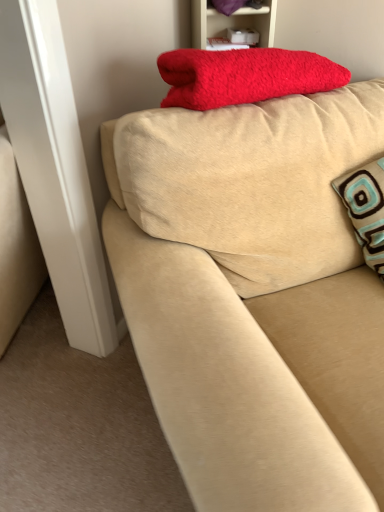
Image resolution: width=384 pixels, height=512 pixels. What are the coordinates of `red fluffy blanket at upper center` in the screenshot? It's located at (232, 22).

In order to face red fluffy blanket at upper center, should I rotate leftwards or rightwards?

It's best to rotate right around 5.121 degrees.

Measure the distance between point (220,21) and camera.

The distance of point (220,21) from camera is 1.51 meters.

What do you see at coordinates (232, 22) in the screenshot? This screenshot has width=384, height=512. I see `red fluffy blanket at upper center` at bounding box center [232, 22].

This screenshot has height=512, width=384. What do you see at coordinates (254, 296) in the screenshot? I see `beige fabric couch at upper center` at bounding box center [254, 296].

Image resolution: width=384 pixels, height=512 pixels. I want to click on beige fabric couch at upper center, so click(254, 296).

Locate an element on the screen. This screenshot has width=384, height=512. red fluffy blanket at upper center is located at coordinates (232, 22).

Is beige fabric couch at upper center to the left of red fluffy blanket at upper center from the viewer's perspective?

Incorrect, beige fabric couch at upper center is not on the left side of red fluffy blanket at upper center.

Is beige fabric couch at upper center positioned in front of red fluffy blanket at upper center?

Yes.

Considering the positions of point (341, 256) and point (194, 15), is point (341, 256) closer or farther from the camera than point (194, 15)?

Clearly, point (341, 256) is closer to the camera than point (194, 15).

From the image's perspective, is beige fabric couch at upper center located above or below red fluffy blanket at upper center?

beige fabric couch at upper center is situated lower than red fluffy blanket at upper center in the image.

From a real-world perspective, is beige fabric couch at upper center physically located above or below red fluffy blanket at upper center?

Result: Clearly, from a real-world perspective, beige fabric couch at upper center is below red fluffy blanket at upper center.

Can you confirm if beige fabric couch at upper center is wider than red fluffy blanket at upper center?

Correct, the width of beige fabric couch at upper center exceeds that of red fluffy blanket at upper center.

In terms of height, does beige fabric couch at upper center look taller or shorter compared to red fluffy blanket at upper center?

beige fabric couch at upper center is taller than red fluffy blanket at upper center.

Who is smaller, beige fabric couch at upper center or red fluffy blanket at upper center?

Smaller between the two is red fluffy blanket at upper center.

Is beige fabric couch at upper center positioned beyond the bounds of red fluffy blanket at upper center?

Yes, beige fabric couch at upper center is outside of red fluffy blanket at upper center.

Is beige fabric couch at upper center positioned far away from red fluffy blanket at upper center?

Actually, beige fabric couch at upper center and red fluffy blanket at upper center are a little close together.

Is beige fabric couch at upper center facing away from red fluffy blanket at upper center?

Correct, beige fabric couch at upper center is looking away from red fluffy blanket at upper center.

In the image, there is a red fluffy blanket at upper center. Where is `studio couch below it (from the image's perspective)`? This screenshot has height=512, width=384. studio couch below it (from the image's perspective) is located at coordinates coord(254,296).

Considering the positions of objects red fluffy blanket at upper center and beige fabric couch at upper center in the image provided, who is more to the left, red fluffy blanket at upper center or beige fabric couch at upper center?

red fluffy blanket at upper center is more to the left.

Considering the positions of objects red fluffy blanket at upper center and beige fabric couch at upper center in the image provided, who is behind, red fluffy blanket at upper center or beige fabric couch at upper center?

red fluffy blanket at upper center is further away from the camera.

Which is less distant, [217,34] or [344,405]?

Positioned in front is point [344,405].

From the image's perspective, is red fluffy blanket at upper center over beige fabric couch at upper center?

Yes, from the image's perspective, red fluffy blanket at upper center is over beige fabric couch at upper center.

From a real-world perspective, is red fluffy blanket at upper center above or below beige fabric couch at upper center?

From a real-world perspective, red fluffy blanket at upper center is physically above beige fabric couch at upper center.

Is red fluffy blanket at upper center wider than beige fabric couch at upper center?

In fact, red fluffy blanket at upper center might be narrower than beige fabric couch at upper center.

Between red fluffy blanket at upper center and beige fabric couch at upper center, which one has less height?

red fluffy blanket at upper center is shorter.

Does red fluffy blanket at upper center have a larger size compared to beige fabric couch at upper center?

No.

Is red fluffy blanket at upper center surrounding beige fabric couch at upper center?

That's incorrect, beige fabric couch at upper center is not inside red fluffy blanket at upper center.

Would you consider red fluffy blanket at upper center to be distant from beige fabric couch at upper center?

They are positioned close to each other.

Is beige fabric couch at upper center at the back of red fluffy blanket at upper center?

red fluffy blanket at upper center does not have its back to beige fabric couch at upper center.

How many degrees apart are the facing directions of red fluffy blanket at upper center and beige fabric couch at upper center?

They differ by 10.2 degrees in their facing directions.

The image size is (384, 512). Find the location of `studio couch beneath the red fluffy blanket at upper center (from a real-world perspective)`. studio couch beneath the red fluffy blanket at upper center (from a real-world perspective) is located at coordinates click(254, 296).

This screenshot has height=512, width=384. I want to click on furniture on the left of beige fabric couch at upper center, so click(x=232, y=22).

Locate an element on the screen. studio couch below the red fluffy blanket at upper center (from the image's perspective) is located at coordinates coord(254,296).